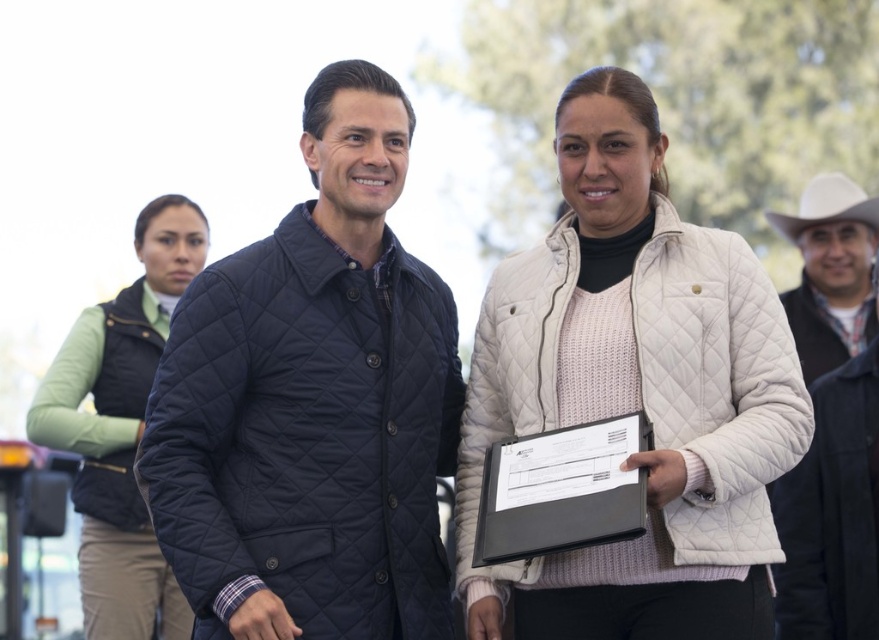
Question: Does white paper at center appear under white felt cowboy hat at right?

Choices:
 (A) yes
 (B) no

Answer: (A)

Question: Can you confirm if white quilted jacket at upper right is bigger than white felt cowboy hat at right?

Choices:
 (A) no
 (B) yes

Answer: (B)

Question: Does white quilted jacket at center have a larger size compared to white quilted jacket at right?

Choices:
 (A) yes
 (B) no

Answer: (B)

Question: Which object appears closest to the camera in this image?

Choices:
 (A) white paper at center
 (B) light green fabric vest at upper left
 (C) white felt cowboy hat at right
 (D) white quilted jacket at right

Answer: (A)

Question: Which is nearer to the light green fabric vest at upper left?

Choices:
 (A) white felt cowboy hat at right
 (B) white paper at center
 (C) navy quilted jacket at center
 (D) white quilted jacket at right

Answer: (C)

Question: Which point is farther to the camera?

Choices:
 (A) (825, 250)
 (B) (819, 237)
 (C) (554, 465)

Answer: (B)